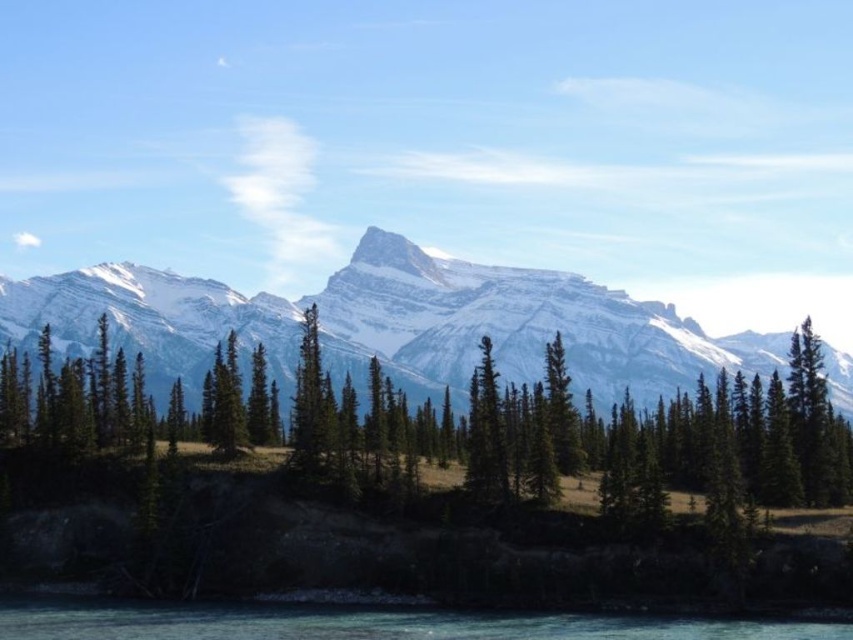
Question: Which of the following is the closest to the observer?

Choices:
 (A) clear blue water at lower center
 (B) green matte tree at center

Answer: (A)

Question: Can you confirm if snowy granite mountain range at center is thinner than clear blue water at lower center?

Choices:
 (A) no
 (B) yes

Answer: (A)

Question: Does clear blue water at lower center have a larger size compared to green matte tree at center?

Choices:
 (A) no
 (B) yes

Answer: (B)

Question: Which object is the closest to the green textured pine trees at center?

Choices:
 (A) snowy granite mountain range at center
 (B) green matte tree at center
 (C) clear blue water at lower center

Answer: (B)

Question: Is snowy granite mountain range at center to the left of clear blue water at lower center from the viewer's perspective?

Choices:
 (A) no
 (B) yes

Answer: (A)

Question: Among these objects, which one is nearest to the camera?

Choices:
 (A) clear blue water at lower center
 (B) green textured pine trees at center
 (C) snowy granite mountain range at center
 (D) green matte tree at center

Answer: (A)